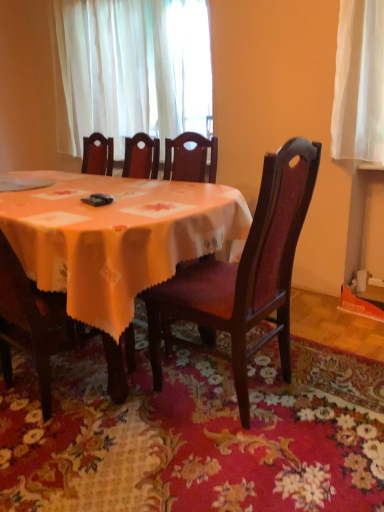
Find the location of a particular element. This screenshot has width=384, height=512. vacant area that lies between wooden chair at center, the 2th chair when ordered from right to left, and matte wood chair at center, which appears as the second chair when viewed from the left is located at coordinates (144, 420).